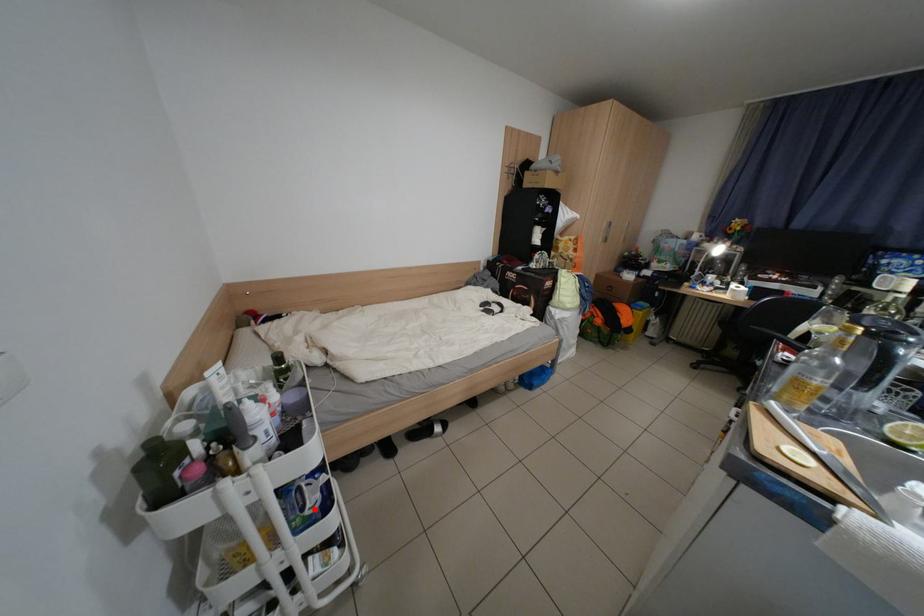
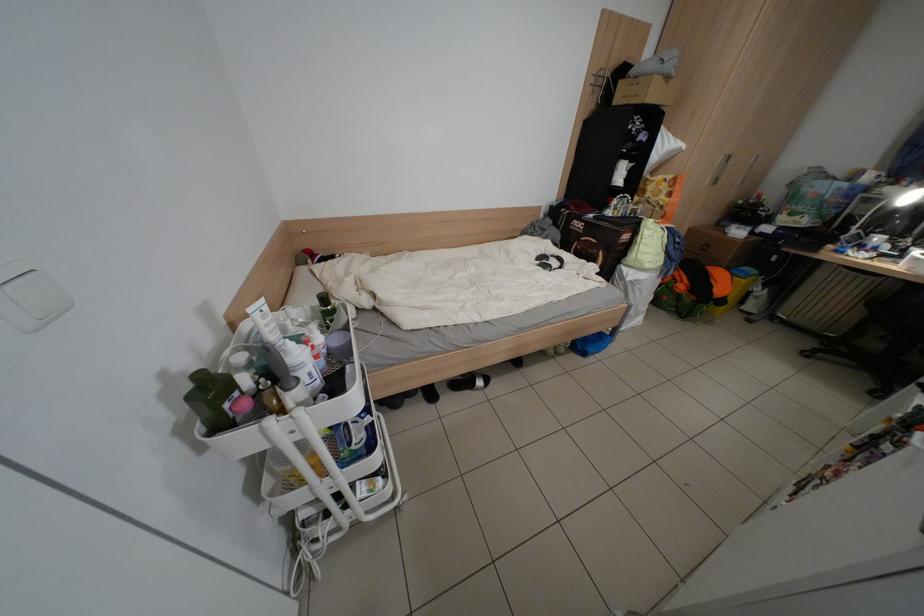
The point at the highlighted location is marked in the first image. Where is the corresponding point in the second image?

(361, 445)